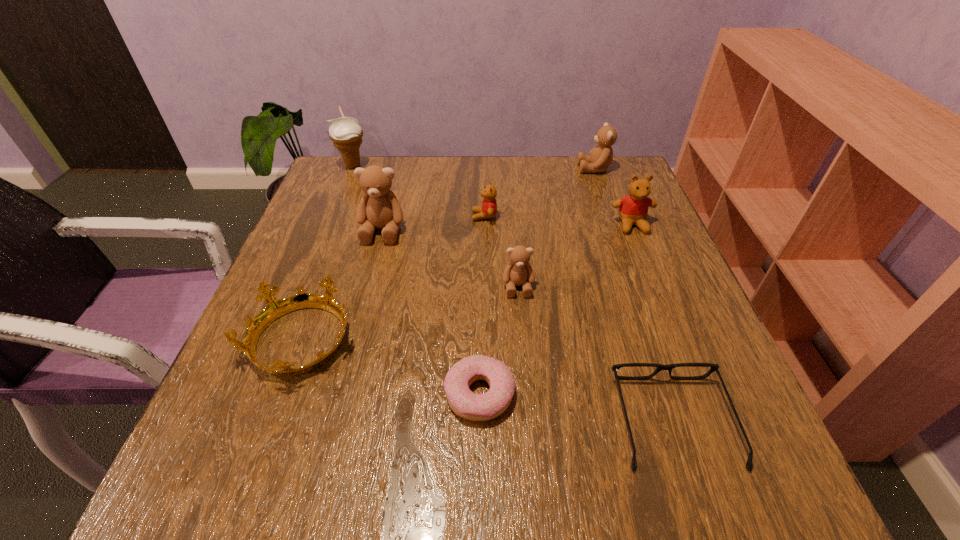
In the image, there is a desktop. At what (x,y) coordinates should I click in order to perform the action: click on free space at the left edge. Please return your answer as a coordinate pair (x, y). Looking at the image, I should click on (302, 393).

Image resolution: width=960 pixels, height=540 pixels. What are the coordinates of `free location at the right edge of the desktop` in the screenshot? It's located at (677, 368).

Find the location of a particular element. This screenshot has height=540, width=960. vacant area at the far left corner of the desktop is located at coordinates coord(340,191).

At what (x,y) coordinates should I click in order to perform the action: click on free location at the near left corner of the desktop. Please return your answer as a coordinate pair (x, y). The width and height of the screenshot is (960, 540). Looking at the image, I should click on (264, 481).

This screenshot has width=960, height=540. In order to click on vacant space at the far right corner of the desktop in this screenshot , I will do `click(579, 176)`.

At what (x,y) coordinates should I click in order to perform the action: click on free space between the farthest teddy bear and the white icecream. Please return your answer as a coordinate pair (x, y). This screenshot has width=960, height=540. Looking at the image, I should click on [x=473, y=167].

Image resolution: width=960 pixels, height=540 pixels. In order to click on vacant space in between the crown and the farthest teddy bear in this screenshot , I will do pyautogui.click(x=448, y=255).

What are the coordinates of `empty space that is in between the third teddy bear from right to left and the spectacles` in the screenshot? It's located at (596, 354).

I want to click on vacant area that lies between the nearest teddy bear and the icecream, so click(x=436, y=226).

You are a GUI agent. You are given a task and a screenshot of the screen. Output one action in this format:
    pyautogui.click(x=<x>, y=<y>)
    Task: Click on the vacant area that lies between the second smallest brown teddy bear and the spectacles
    
    Given the screenshot: What is the action you would take?
    [x=634, y=295]